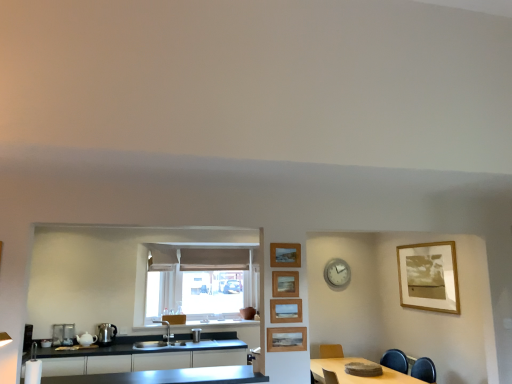
Question: Is the position of matte beige curtain at center more distant than that of wooden framed photo at upper right, which is the 1th picture frame in right-to-left order?

Choices:
 (A) yes
 (B) no

Answer: (A)

Question: Is matte beige curtain at center at the right side of wooden framed photo at upper right, which appears as the fifth picture frame when viewed from the left?

Choices:
 (A) yes
 (B) no

Answer: (B)

Question: Considering the relative sizes of matte beige curtain at center and wooden framed photo at upper right, which is the 1th picture frame in right-to-left order, in the image provided, is matte beige curtain at center wider than wooden framed photo at upper right, which is the 1th picture frame in right-to-left order,?

Choices:
 (A) no
 (B) yes

Answer: (B)

Question: Considering the relative sizes of matte beige curtain at center and wooden framed photo at upper right, placed as the 1th picture frame when sorted from back to front, in the image provided, is matte beige curtain at center smaller than wooden framed photo at upper right, placed as the 1th picture frame when sorted from back to front,?

Choices:
 (A) no
 (B) yes

Answer: (A)

Question: Is matte beige curtain at center not inside wooden framed photo at upper right, placed as the 1th picture frame when sorted from back to front?

Choices:
 (A) no
 (B) yes

Answer: (B)

Question: Is wooden framed photo at upper right, which appears as the fifth picture frame when viewed from the left, inside matte beige curtain at center?

Choices:
 (A) no
 (B) yes

Answer: (A)

Question: Considering the relative sizes of white metallic clock at upper center and wooden picture frame at upper center, which is counted as the fourth picture frame, starting from the front, in the image provided, is white metallic clock at upper center shorter than wooden picture frame at upper center, which is counted as the fourth picture frame, starting from the front,?

Choices:
 (A) yes
 (B) no

Answer: (B)

Question: Is white metallic clock at upper center oriented away from wooden picture frame at upper center, which is counted as the fourth picture frame, starting from the front?

Choices:
 (A) no
 (B) yes

Answer: (A)

Question: Is wooden picture frame at upper center, which is counted as the fourth picture frame, starting from the front, surrounded by white metallic clock at upper center?

Choices:
 (A) no
 (B) yes

Answer: (A)

Question: Is white metallic clock at upper center further to camera compared to wooden picture frame at upper center, the second picture frame from the back?

Choices:
 (A) no
 (B) yes

Answer: (B)

Question: Is white metallic clock at upper center positioned in front of wooden picture frame at upper center, the first picture frame positioned from the left?

Choices:
 (A) yes
 (B) no

Answer: (B)

Question: Is white metallic clock at upper center at the right side of wooden picture frame at upper center, which is the fifth picture frame in right-to-left order?

Choices:
 (A) no
 (B) yes

Answer: (B)

Question: From a real-world perspective, is wooden framed photo at upper right, placed as the 1th picture frame when sorted from back to front, located beneath wooden table at lower right?

Choices:
 (A) yes
 (B) no

Answer: (B)